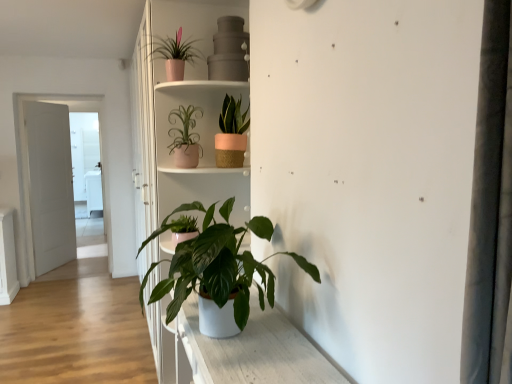
Question: Does green matte plant at center, positioned as the 4th houseplant in top-to-bottom order, appear on the right side of matte pink woven pot at upper center, the third houseplant from the bottom?

Choices:
 (A) no
 (B) yes

Answer: (A)

Question: Can you confirm if green matte plant at center, positioned as the 4th houseplant in top-to-bottom order, is bigger than matte pink woven pot at upper center, the third houseplant from the bottom?

Choices:
 (A) no
 (B) yes

Answer: (B)

Question: Considering the relative sizes of green matte plant at center, which is counted as the 1th houseplant, starting from the bottom, and matte pink woven pot at upper center, the 2th houseplant positioned from the top, in the image provided, is green matte plant at center, which is counted as the 1th houseplant, starting from the bottom, smaller than matte pink woven pot at upper center, the 2th houseplant positioned from the top,?

Choices:
 (A) no
 (B) yes

Answer: (A)

Question: Is green matte plant at center, which is counted as the 1th houseplant, starting from the bottom, thinner than matte pink woven pot at upper center, the third houseplant from the bottom?

Choices:
 (A) yes
 (B) no

Answer: (B)

Question: From a real-world perspective, does green matte plant at center, which is counted as the 1th houseplant, starting from the bottom, stand above matte pink woven pot at upper center, the third houseplant from the bottom?

Choices:
 (A) no
 (B) yes

Answer: (A)

Question: Relative to pink matte pot at upper center, the 4th houseplant when ordered from bottom to top, is white matte bookshelf at center in front or behind?

Choices:
 (A) front
 (B) behind

Answer: (B)

Question: Is point (147, 183) positioned closer to the camera than point (165, 66)?

Choices:
 (A) closer
 (B) farther

Answer: (B)

Question: Is white matte bookshelf at center bigger or smaller than pink matte pot at upper center, marked as the 1th houseplant in a top-to-bottom arrangement?

Choices:
 (A) small
 (B) big

Answer: (B)

Question: Is white matte bookshelf at center situated inside pink matte pot at upper center, the 4th houseplant when ordered from bottom to top, or outside?

Choices:
 (A) inside
 (B) outside

Answer: (B)

Question: From a real-world perspective, is white matte door at left above or below white matte bookshelf at center?

Choices:
 (A) below
 (B) above

Answer: (A)

Question: From the image's perspective, relative to white matte bookshelf at center, is white matte door at left above or below?

Choices:
 (A) above
 (B) below

Answer: (B)

Question: Is white matte door at left taller or shorter than white matte bookshelf at center?

Choices:
 (A) tall
 (B) short

Answer: (B)

Question: Is white matte door at left wider or thinner than white matte bookshelf at center?

Choices:
 (A) wide
 (B) thin

Answer: (B)

Question: In terms of width, does matte pink pot at upper center, which is the third houseplant in top-to-bottom order, look wider or thinner when compared to green matte plant at center, positioned as the 4th houseplant in top-to-bottom order?

Choices:
 (A) thin
 (B) wide

Answer: (A)

Question: In the image, is matte pink pot at upper center, acting as the second houseplant starting from the bottom, on the left side or the right side of green matte plant at center, positioned as the 4th houseplant in top-to-bottom order?

Choices:
 (A) right
 (B) left

Answer: (B)